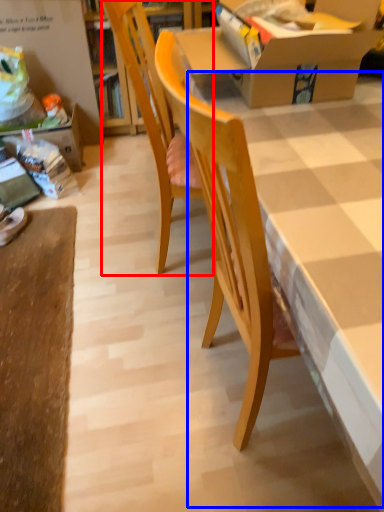
Question: Which object appears closest to the camera in this image, chair (highlighted by a red box) or table (highlighted by a blue box)?

Choices:
 (A) chair
 (B) table

Answer: (B)